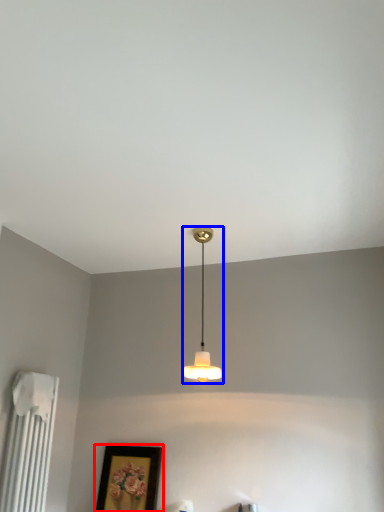
Question: Which of the following is the closest to the observer, picture frame (highlighted by a red box) or lamp (highlighted by a blue box)?

Choices:
 (A) picture frame
 (B) lamp

Answer: (B)